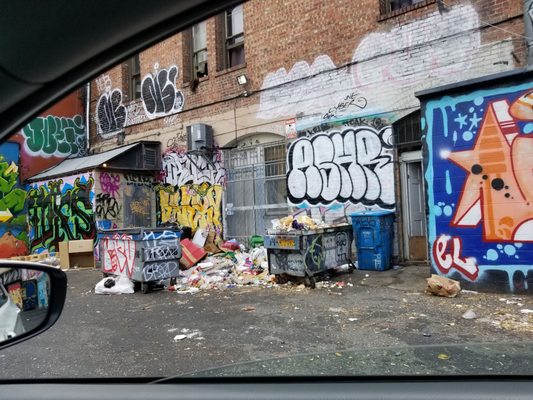
Where is `windows`? windows is located at coordinates (139, 76), (198, 59), (236, 47), (395, 3), (411, 133), (276, 159), (276, 195).